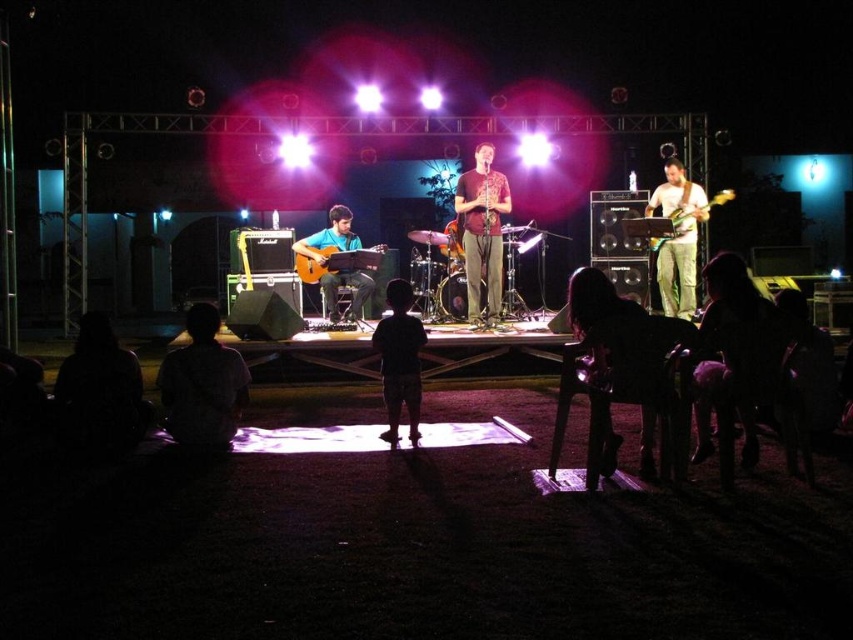
Question: From the image, what is the correct spatial relationship of fuzzy pink dress at lower right in relation to green camouflage pants at right?

Choices:
 (A) below
 (B) above

Answer: (A)

Question: Based on their relative distances, which object is farther from the fuzzy pink dress at lower right?

Choices:
 (A) matte brown acoustic guitar at center
 (B) green camouflage pants at right
 (C) matte brown saxophone at center

Answer: (A)

Question: Among these objects, which one is farthest from the camera?

Choices:
 (A) fuzzy pink dress at lower right
 (B) matte brown acoustic guitar at center
 (C) silhouette fabric at lower left

Answer: (B)

Question: Which of the following is the farthest from the observer?

Choices:
 (A) matte yellow guitar at center
 (B) green camouflage pants at right
 (C) matte brown acoustic guitar at center
 (D) silhouette fabric at lower left

Answer: (B)

Question: Is green camouflage pants at right further to camera compared to matte yellow guitar at center?

Choices:
 (A) yes
 (B) no

Answer: (A)

Question: In this image, where is fuzzy pink dress at lower right located relative to matte brown acoustic guitar at center?

Choices:
 (A) right
 (B) left

Answer: (A)